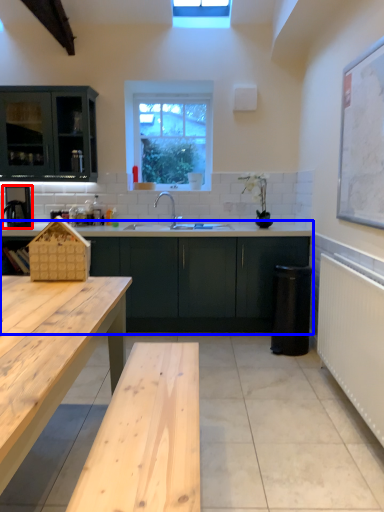
Question: Which point is closer to the camera, appliance (highlighted by a red box) or cabinetry (highlighted by a blue box)?

Choices:
 (A) appliance
 (B) cabinetry

Answer: (B)